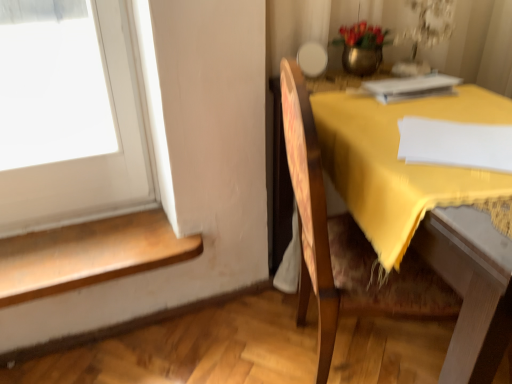
This screenshot has height=384, width=512. Find the location of `unoccupied area in front of white paper at upper right`. unoccupied area in front of white paper at upper right is located at coordinates (433, 114).